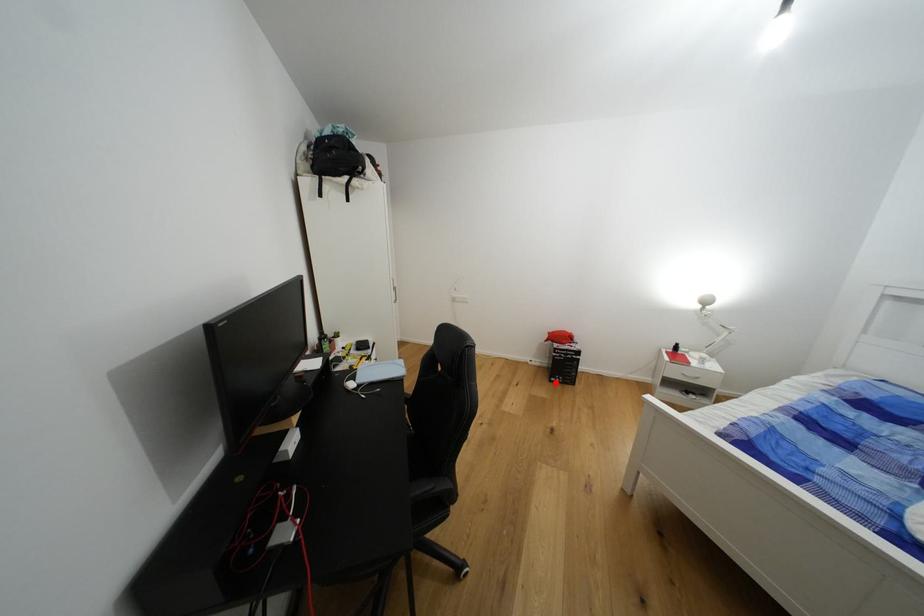
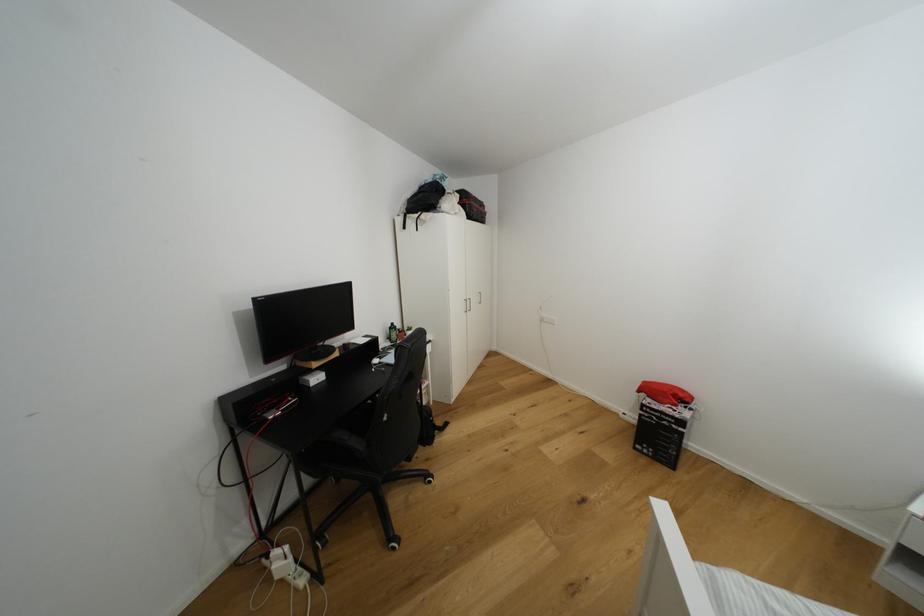
Where in the second image is the point corresponding to the highlighted location from the first image?

(639, 450)